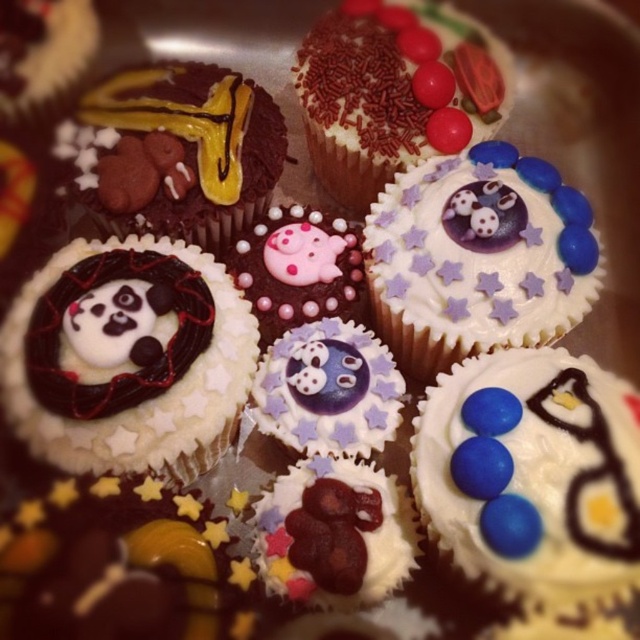
In the image of cupcakes arranged on a metallic tray, there is a white fondant cupcake with panda decoration at center. Where is it located in terms of coordinates?

The white fondant cupcake with panda decoration at center is located at coordinates point (128, 358).

You are a baker who wants to stack these cupcakes for a display. The white fondant cupcake with panda decoration at center and the sprinkled chocolate cupcake at center are both candidates. Which one should you choose to place on top to ensure stability?

The white fondant cupcake with panda decoration at center has a lesser height compared to the sprinkled chocolate cupcake at center. Therefore, placing the shorter one on top would provide better stability as it has a smaller surface area to tip over.

You are a baker trying to fit both the white fondant cupcake with panda decoration at center and the sprinkled chocolate cupcake at center into a small box. Which cupcake should you place first to ensure both fit?

The white fondant cupcake with panda decoration at center is smaller than the sprinkled chocolate cupcake at center, so you should place the smaller one first to make space for the larger one.